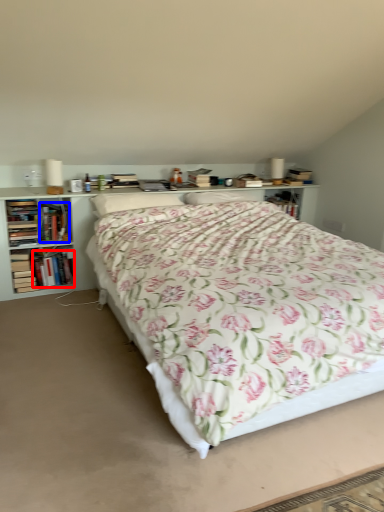
Question: Which object appears closest to the camera in this image, book (highlighted by a red box) or book (highlighted by a blue box)?

Choices:
 (A) book
 (B) book

Answer: (B)